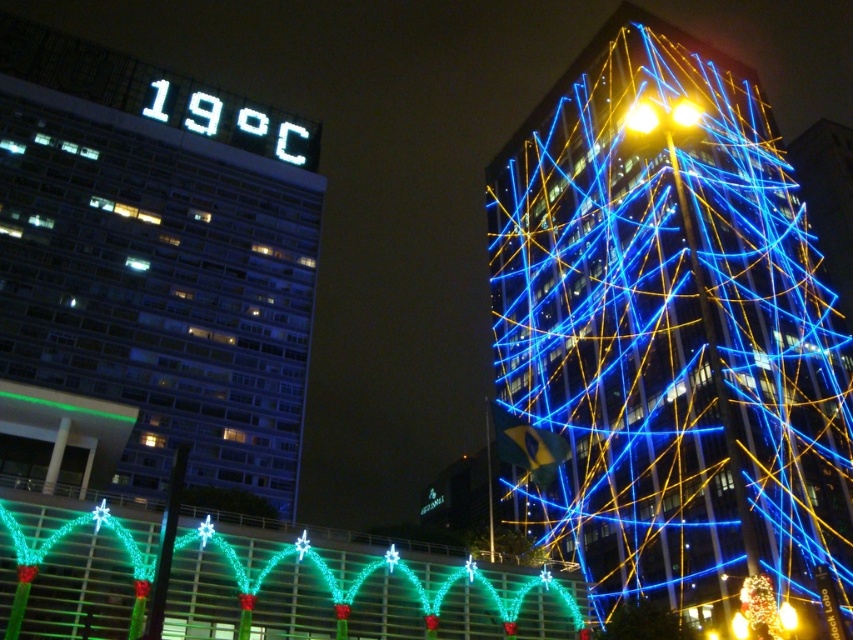
Can you confirm if illuminated wireframe tree at center is positioned to the right of yellow matte light at upper right?

In fact, illuminated wireframe tree at center is to the left of yellow matte light at upper right.

Is point (605, 637) positioned behind point (779, 609)?

Yes, point (605, 637) is farther from viewer.

Is point (665, 611) closer to viewer compared to point (795, 616)?

No, it is behind (795, 616).

Find the location of a particular element. This screenshot has width=853, height=640. illuminated wireframe tree at center is located at coordinates (643, 621).

Does point (456, 563) come in front of point (665, 627)?

Yes, point (456, 563) is closer to viewer.

At what (x,y) coordinates should I click in order to perform the action: click on green glossy lights at center. Please return your answer as a coordinate pair (x, y). Looking at the image, I should click on (352, 593).

Who is more forward, (669, 371) or (236, 260)?

Point (669, 371)

Between blue wireframe structure at upper right and white digital sign at upper center, which one has less height?

Standing shorter between the two is white digital sign at upper center.

Which is in front, point (515, 161) or point (77, 179)?

Point (77, 179) is more forward.

Locate an element on the screen. Image resolution: width=853 pixels, height=640 pixels. blue wireframe structure at upper right is located at coordinates (672, 339).